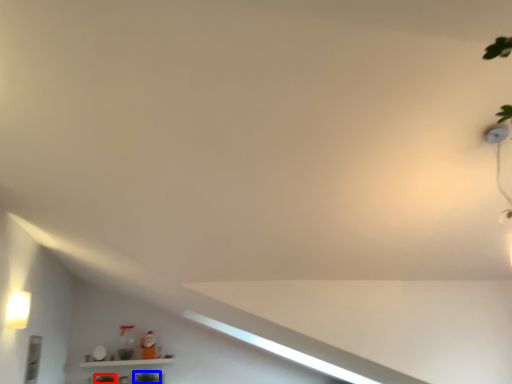
Question: Which object is further to the camera taking this photo, plant (highlighted by a red box) or plant (highlighted by a blue box)?

Choices:
 (A) plant
 (B) plant

Answer: (B)